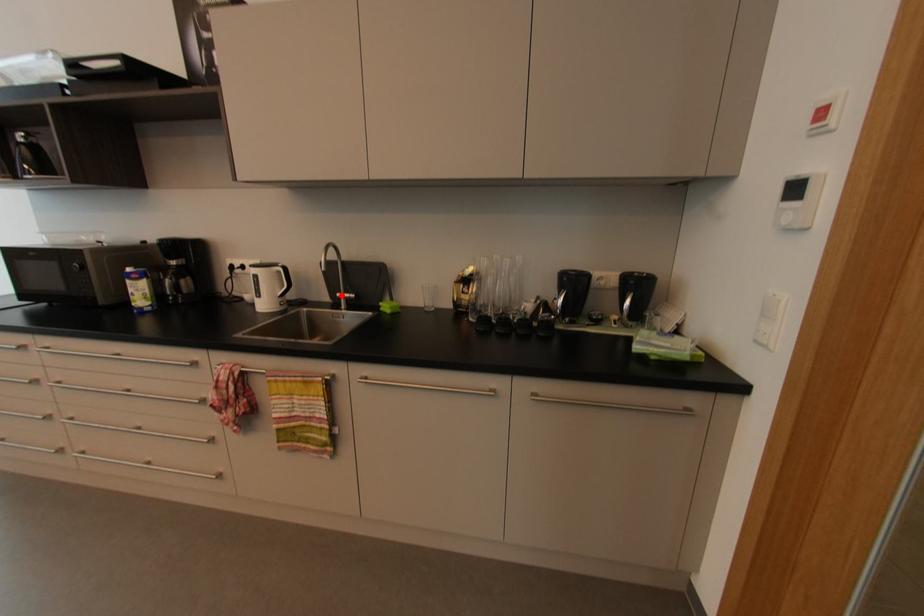
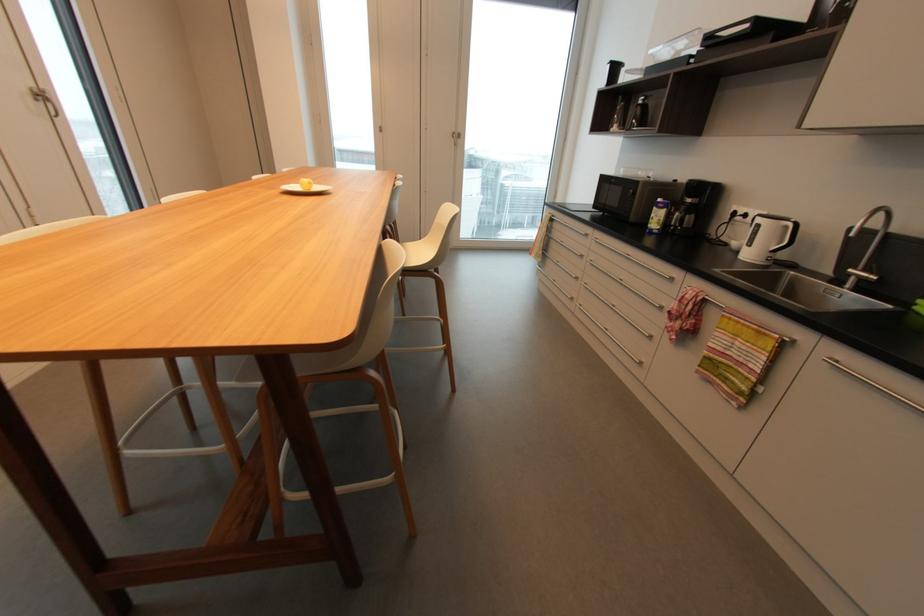
Where in the second image is the point corresponding to the highlighted location from the first image?

(854, 270)